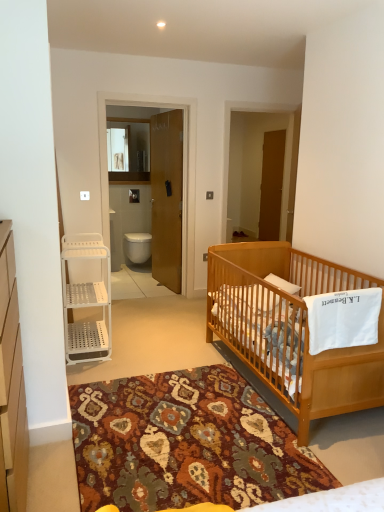
Question: Does brown wooden door at center come in front of white plastic shelving unit at left?

Choices:
 (A) no
 (B) yes

Answer: (A)

Question: Considering the relative sizes of brown wooden door at center and white plastic shelving unit at left in the image provided, is brown wooden door at center smaller than white plastic shelving unit at left?

Choices:
 (A) yes
 (B) no

Answer: (B)

Question: Does brown wooden door at center appear on the right side of white plastic shelving unit at left?

Choices:
 (A) yes
 (B) no

Answer: (A)

Question: Can you see brown wooden door at center touching white plastic shelving unit at left?

Choices:
 (A) no
 (B) yes

Answer: (A)

Question: From a real-world perspective, is brown wooden door at center over white plastic shelving unit at left?

Choices:
 (A) yes
 (B) no

Answer: (A)

Question: Is brown wooden door at center oriented away from white plastic shelving unit at left?

Choices:
 (A) no
 (B) yes

Answer: (A)

Question: From the image's perspective, is brown wooden screen door at center below white plastic shelf at left?

Choices:
 (A) no
 (B) yes

Answer: (A)

Question: Can you confirm if brown wooden screen door at center is shorter than white plastic shelf at left?

Choices:
 (A) yes
 (B) no

Answer: (B)

Question: Is brown wooden screen door at center at the right side of white plastic shelf at left?

Choices:
 (A) yes
 (B) no

Answer: (A)

Question: From a real-world perspective, is brown wooden screen door at center positioned over white plastic shelf at left based on gravity?

Choices:
 (A) yes
 (B) no

Answer: (A)

Question: Is brown wooden screen door at center oriented away from white plastic shelf at left?

Choices:
 (A) yes
 (B) no

Answer: (B)

Question: Does brown wooden screen door at center appear on the left side of white plastic shelf at left?

Choices:
 (A) yes
 (B) no

Answer: (B)

Question: Is light brown wooden crib at lower right to the right of white plastic shelving unit at left from the viewer's perspective?

Choices:
 (A) yes
 (B) no

Answer: (A)